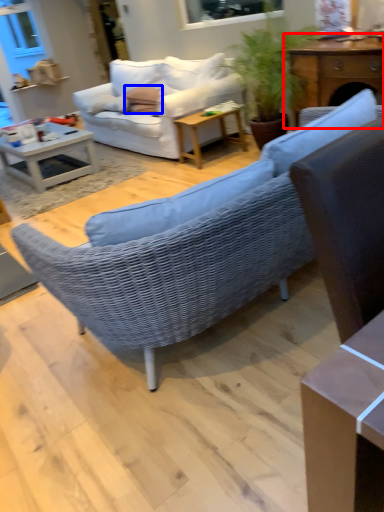
Question: Which object appears farthest to the camera in this image, table (highlighted by a red box) or pillow (highlighted by a blue box)?

Choices:
 (A) table
 (B) pillow

Answer: (B)